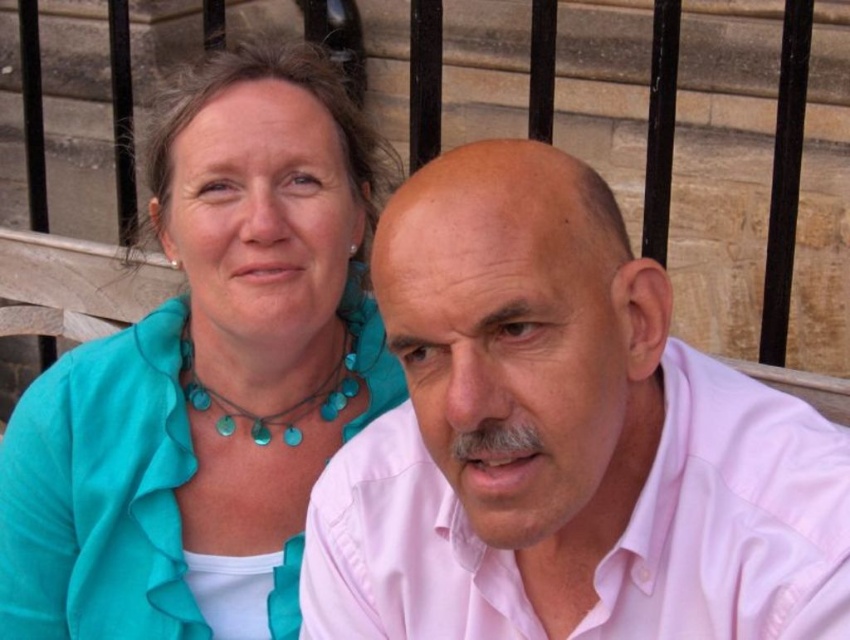
From the picture: Who is taller, teal fabric blouse at upper left or turquoise beads at center?

With more height is teal fabric blouse at upper left.

Between point (248, 564) and point (350, 346), which one is positioned behind?

The point (350, 346) is behind.

Does point (219, 392) come closer to viewer compared to point (259, 438)?

No.

Where is `teal fabric blouse at upper left`? teal fabric blouse at upper left is located at coordinates click(208, 376).

Who is more distant from viewer, [654,292] or [341,211]?

Point [341,211]

Who is taller, pink cotton shirt at center or teal fabric blouse at upper left?

teal fabric blouse at upper left

In order to click on pink cotton shirt at center in this screenshot , I will do `click(564, 440)`.

Which is below, pink cotton shirt at center or turquoise beads at center?

Positioned lower is pink cotton shirt at center.

Measure the distance from pink cotton shirt at center to turquoise beads at center.

pink cotton shirt at center and turquoise beads at center are 3.35 feet apart from each other.

Does point (766, 600) lie behind point (230, 424)?

No, (766, 600) is in front of (230, 424).

What are the coordinates of `pink cotton shirt at center` in the screenshot? It's located at (564, 440).